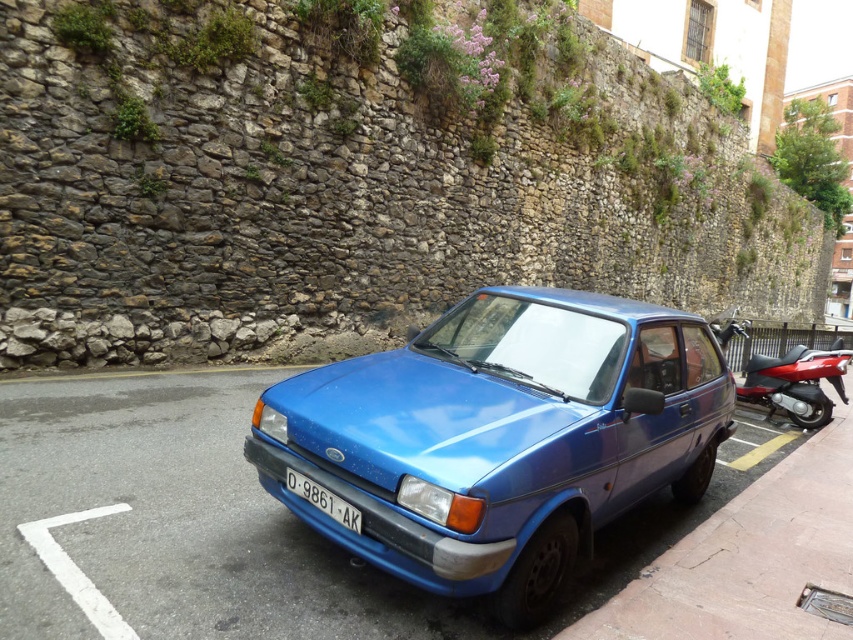
Question: Can you confirm if blue asphalt pavement at center is positioned above black plastic license plate at center?

Choices:
 (A) no
 (B) yes

Answer: (A)

Question: Which point is farther to the camera?

Choices:
 (A) (354, 512)
 (B) (544, 384)
 (C) (247, 545)

Answer: (B)

Question: Is metallic blue car at center above blue asphalt pavement at center?

Choices:
 (A) no
 (B) yes

Answer: (B)

Question: Which of the following is the closest to the observer?

Choices:
 (A) (337, 506)
 (B) (775, 372)
 (C) (432, 433)

Answer: (C)

Question: Among these points, which one is farthest from the camera?

Choices:
 (A) (225, 388)
 (B) (746, 326)
 (C) (308, 497)

Answer: (B)

Question: Does blue asphalt pavement at center have a larger size compared to shiny red motorcycle at right?

Choices:
 (A) no
 (B) yes

Answer: (A)